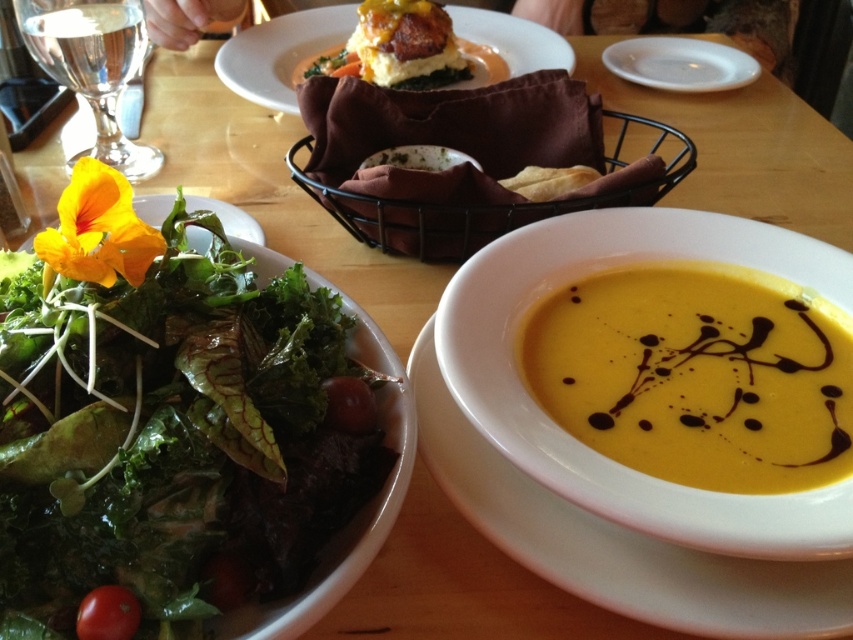
Question: Based on their relative distances, which object is farther from the white ceramic plate at upper right?

Choices:
 (A) red smooth tomato at lower left
 (B) red matte tomato at lower left

Answer: (A)

Question: Which point appears farthest from the camera in this image?

Choices:
 (A) (335, 410)
 (B) (274, 97)
 (C) (630, 42)

Answer: (C)

Question: Estimate the real-world distances between objects in this image. Which object is farther from the matte brown plate at upper center?

Choices:
 (A) green leafymaterial/textureobject at left
 (B) white ceramic plate at upper right
 (C) red matte tomato at lower left
 (D) red smooth tomato at lower left

Answer: (D)

Question: Is white ceramic plate at upper right positioned behind red smooth tomato at lower left?

Choices:
 (A) no
 (B) yes

Answer: (B)

Question: Does yellow creamy soup at center have a lesser width compared to white ceramic plate at upper right?

Choices:
 (A) yes
 (B) no

Answer: (A)

Question: Can you confirm if green leafymaterial/textureobject at left is thinner than matte brown plate at upper center?

Choices:
 (A) no
 (B) yes

Answer: (B)